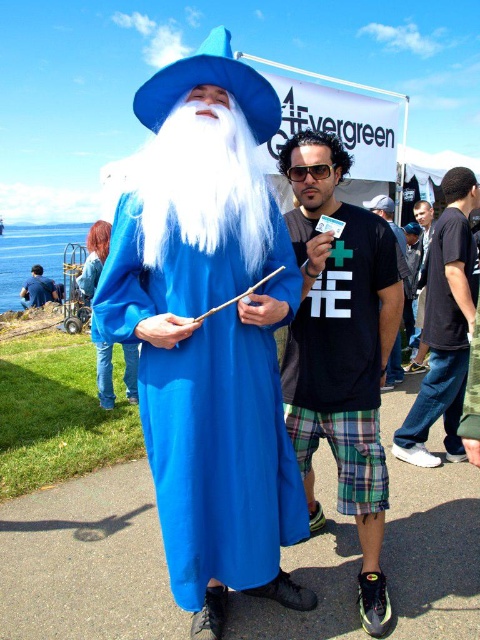
You are a photographer trying to capture both the plaid shorts at center and the white fluffy beard at center in a single frame. Which object should you focus on first to ensure both are in the frame?

The plaid shorts at center is bigger than the white fluffy beard at center, so you should focus on the plaid shorts at center first to ensure both are in the frame.